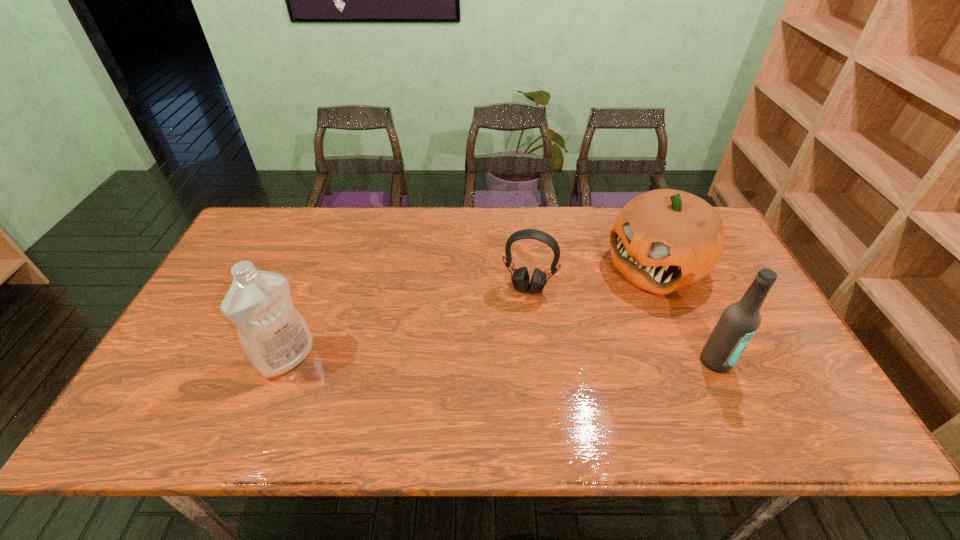
Find the location of a particular element. free spot between the headset and the leftmost object is located at coordinates (407, 323).

Where is `empty location between the leftmost object and the headset`? empty location between the leftmost object and the headset is located at coordinates (407, 323).

At what (x,y) coordinates should I click in order to perform the action: click on vacant area between the beer bottle and the pumpkin. Please return your answer as a coordinate pair (x, y). This screenshot has width=960, height=540. Looking at the image, I should click on (685, 314).

The width and height of the screenshot is (960, 540). Identify the location of vacant space that's between the beer bottle and the shortest object. [622, 325].

Locate which object ranks in proximity to the third object from right to left. Please provide its 2D coordinates. Your answer should be formatted as a tuple, i.e. [(x, y)], where the tuple contains the x and y coordinates of a point satisfying the conditions above.

[(662, 240)]

Locate an element on the screen. object that is the third closest to the leftmost object is located at coordinates (739, 322).

The width and height of the screenshot is (960, 540). In order to click on vacant space that satisfies the following two spatial constraints: 1. on the back side of the shortest object; 2. on the left side of the detergent in this screenshot , I will do `click(313, 288)`.